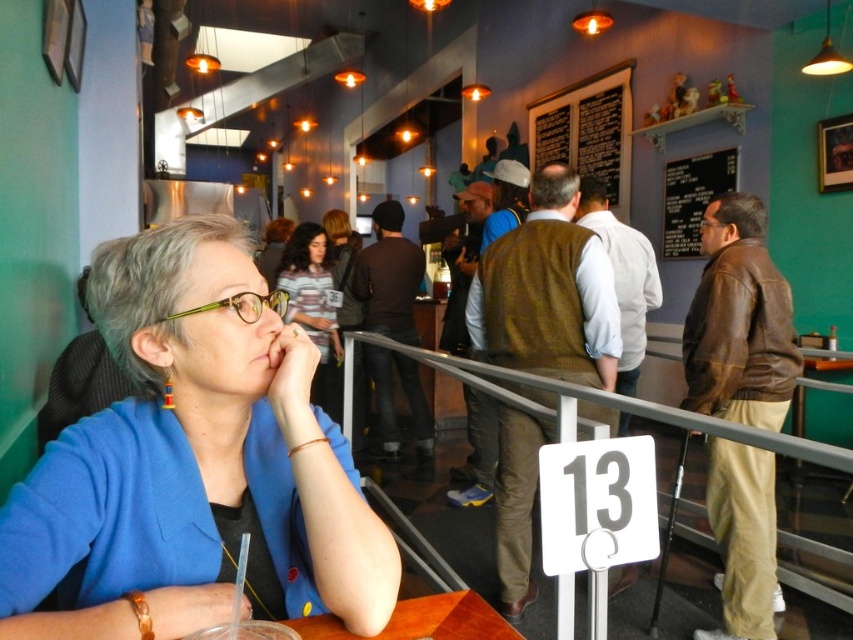
You are a customer in the diner and want to place your phone on the table where the blue fabric jacket at upper left is located. Is there enough space for your phone next to the jacket?

The blue fabric jacket at upper left is located at point (193, 464), so there might be enough space for your phone next to it depending on the table size and other items present.

You are a customer in this dining establishment and want to order a drink. You see the blue fabric jacket at upper left and the striped fabric shirt at center. Which clothing item is closer to the table where the drink is placed?

The blue fabric jacket at upper left is positioned under the striped fabric shirt at center, so the striped fabric shirt at center is closer to the table where the drink is placed.